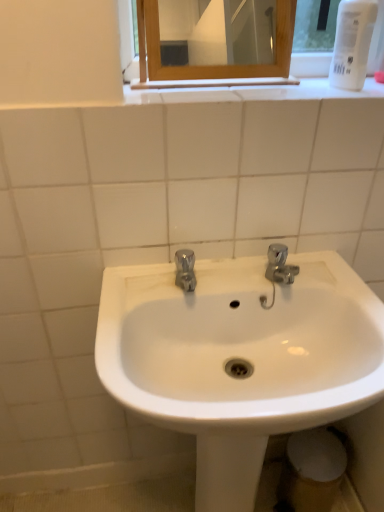
Question: Is white plastic bottle at upper right not within polished chrome faucet at center?

Choices:
 (A) no
 (B) yes

Answer: (B)

Question: Is polished chrome faucet at center completely or partially inside white plastic bottle at upper right?

Choices:
 (A) no
 (B) yes

Answer: (A)

Question: Is the position of white plastic bottle at upper right more distant than that of polished chrome faucet at center?

Choices:
 (A) no
 (B) yes

Answer: (A)

Question: Does white plastic bottle at upper right have a smaller size compared to polished chrome faucet at center?

Choices:
 (A) no
 (B) yes

Answer: (A)

Question: Is white plastic bottle at upper right positioned in front of polished chrome faucet at center?

Choices:
 (A) yes
 (B) no

Answer: (A)

Question: Relative to white glossy sink at center, is white plastic bottle at upper right in front or behind?

Choices:
 (A) front
 (B) behind

Answer: (B)

Question: From a real-world perspective, relative to white glossy sink at center, is white plastic bottle at upper right vertically above or below?

Choices:
 (A) above
 (B) below

Answer: (A)

Question: From the image's perspective, is white plastic bottle at upper right located above or below white glossy sink at center?

Choices:
 (A) above
 (B) below

Answer: (A)

Question: Based on their sizes in the image, would you say white plastic bottle at upper right is bigger or smaller than white glossy sink at center?

Choices:
 (A) big
 (B) small

Answer: (B)

Question: In terms of height, does wooden-framed mirror at upper center look taller or shorter compared to white plastic bottle at upper right?

Choices:
 (A) tall
 (B) short

Answer: (B)

Question: From a real-world perspective, is wooden-framed mirror at upper center physically located above or below white plastic bottle at upper right?

Choices:
 (A) above
 (B) below

Answer: (B)

Question: From the image's perspective, is wooden-framed mirror at upper center above or below white plastic bottle at upper right?

Choices:
 (A) below
 (B) above

Answer: (A)

Question: Based on their positions, is wooden-framed mirror at upper center located to the left or right of white plastic bottle at upper right?

Choices:
 (A) left
 (B) right

Answer: (A)

Question: Considering their positions, is polished chrome faucet at center located in front of or behind white plastic bottle at upper right?

Choices:
 (A) behind
 (B) front

Answer: (A)

Question: Considering the positions of polished chrome faucet at center and white plastic bottle at upper right in the image, is polished chrome faucet at center wider or thinner than white plastic bottle at upper right?

Choices:
 (A) wide
 (B) thin

Answer: (B)